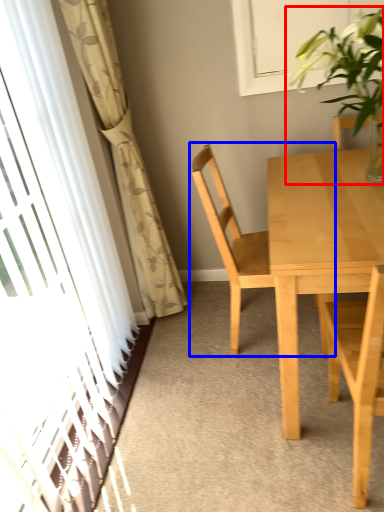
Question: Which object appears closest to the camera in this image, houseplant (highlighted by a red box) or chair (highlighted by a blue box)?

Choices:
 (A) houseplant
 (B) chair

Answer: (A)